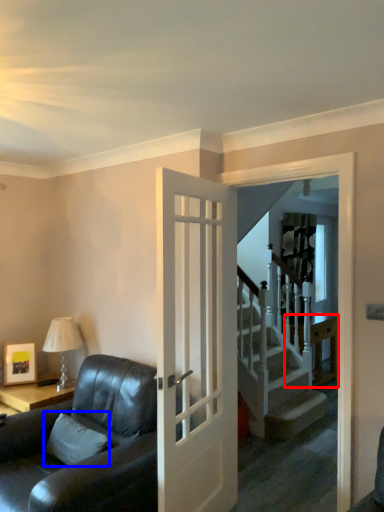
Question: Which point is closer to the camera, table (highlighted by a red box) or pillow (highlighted by a blue box)?

Choices:
 (A) table
 (B) pillow

Answer: (B)